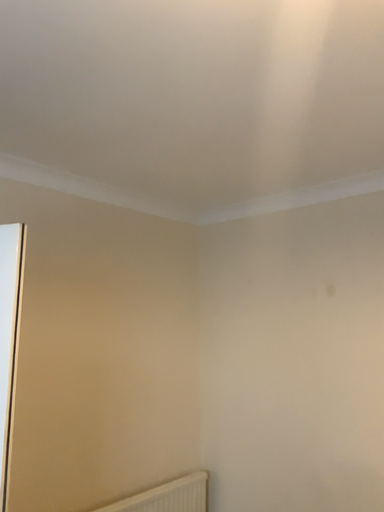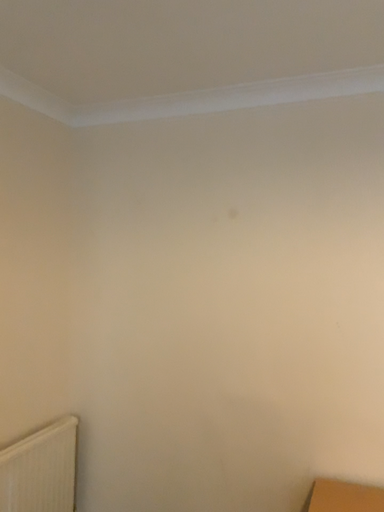
Question: Which way did the camera rotate in the video?

Choices:
 (A) rotated right
 (B) rotated left

Answer: (A)